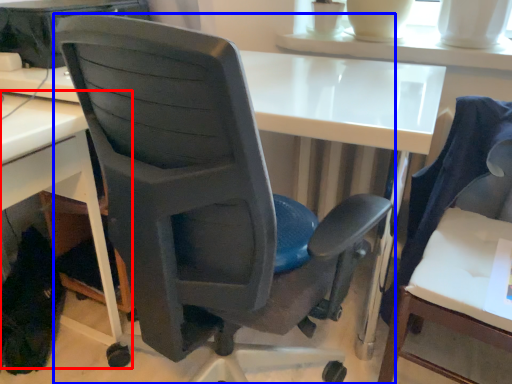
Question: Which point is further to the camera, desk (highlighted by a red box) or chair (highlighted by a blue box)?

Choices:
 (A) desk
 (B) chair

Answer: (A)